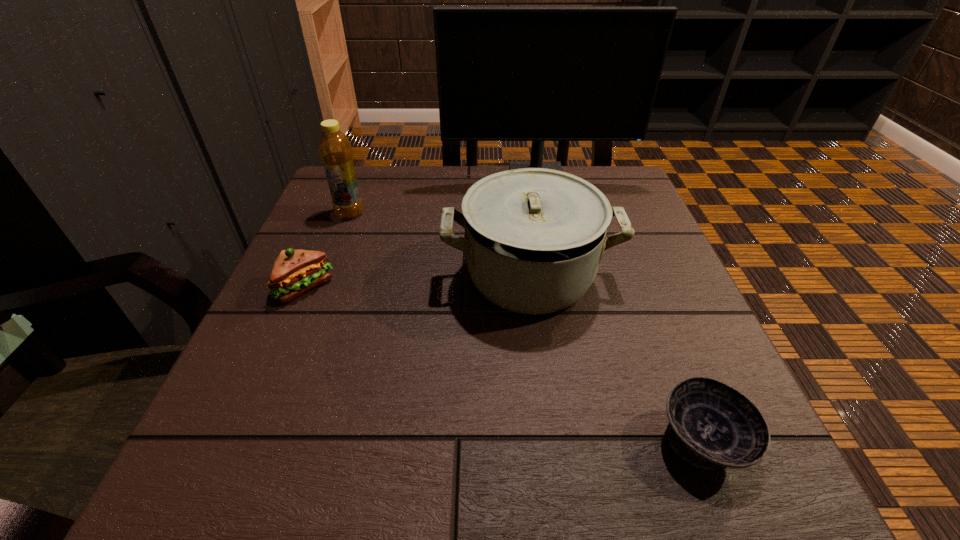
The image size is (960, 540). In order to click on bowl at the right edge in this screenshot , I will do `click(711, 425)`.

Identify the location of object located at the far left corner. Image resolution: width=960 pixels, height=540 pixels. (335, 150).

Locate an element on the screen. This screenshot has width=960, height=540. object that is at the far right corner is located at coordinates (538, 74).

You are a GUI agent. You are given a task and a screenshot of the screen. Output one action in this format:
    pyautogui.click(x=<x>, y=<y>)
    Task: Click on the object that is at the near right corner
    The image size is (960, 540).
    Given the screenshot: What is the action you would take?
    pyautogui.click(x=711, y=425)

Locate an element on the screen. vacant space at the far edge is located at coordinates (428, 187).

Where is `vacant space at the left edge`? The height and width of the screenshot is (540, 960). vacant space at the left edge is located at coordinates (234, 427).

I want to click on vacant space at the right edge of the desktop, so click(x=611, y=224).

Find the location of a particular element. Image resolution: width=960 pixels, height=540 pixels. free space at the far left corner of the desktop is located at coordinates (381, 192).

At what (x,y) coordinates should I click in order to perform the action: click on vacant space at the near left corner of the desktop. Please return your answer as a coordinate pair (x, y). This screenshot has height=540, width=960. Looking at the image, I should click on (185, 497).

This screenshot has height=540, width=960. In the image, there is a desktop. What are the coordinates of `free space at the near right corner` in the screenshot? It's located at (664, 496).